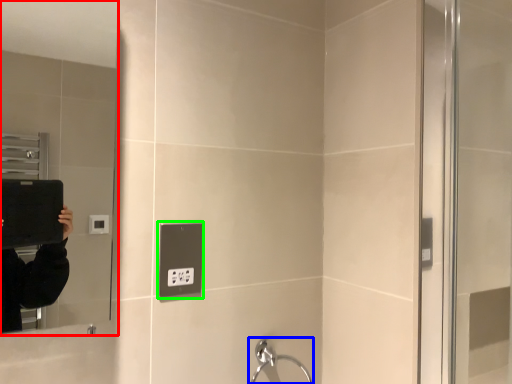
Question: Which is farther away from mirror (highlighted by a red box)? faucet (highlighted by a blue box) or electric outlet (highlighted by a green box)?

Choices:
 (A) faucet
 (B) electric outlet

Answer: (A)